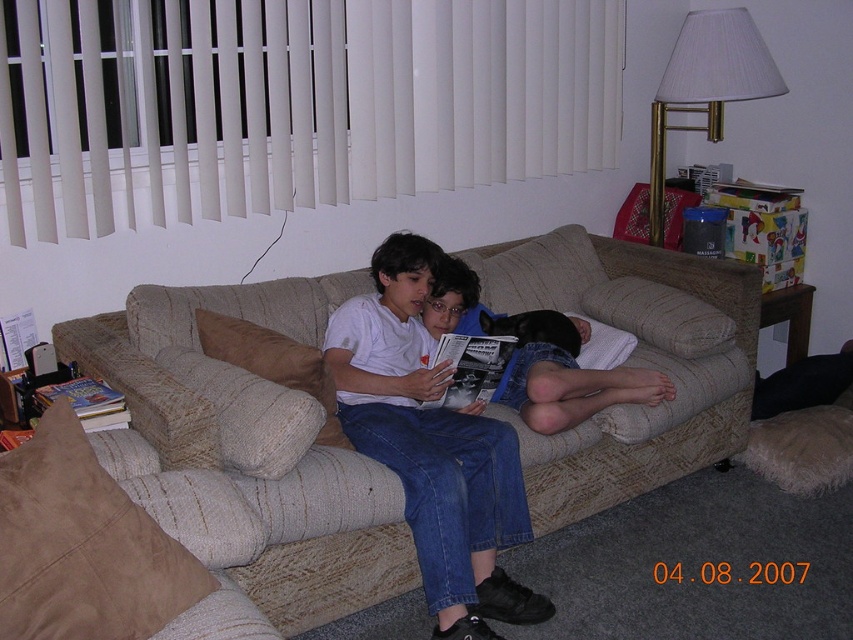
Question: Which object appears farthest from the camera in this image?

Choices:
 (A) suede pillow at lower left
 (B) gold metallic lampshade at upper right
 (C) matte white shirt at center
 (D) black glossy magazine at center

Answer: (B)

Question: Is gold metallic lampshade at upper right below hardcover book at left?

Choices:
 (A) yes
 (B) no

Answer: (B)

Question: Is white vertical blinds at upper center positioned at the back of suede pillow at lower left?

Choices:
 (A) yes
 (B) no

Answer: (A)

Question: Which of the following is the farthest from the observer?

Choices:
 (A) matte white shirt at center
 (B) gold metallic lampshade at upper right

Answer: (B)

Question: Is gold metallic lampshade at upper right positioned in front of hardcover book at left?

Choices:
 (A) yes
 (B) no

Answer: (B)

Question: Which of the following is the farthest from the observer?

Choices:
 (A) suede pillow at lower left
 (B) beige fabric couch at center

Answer: (B)